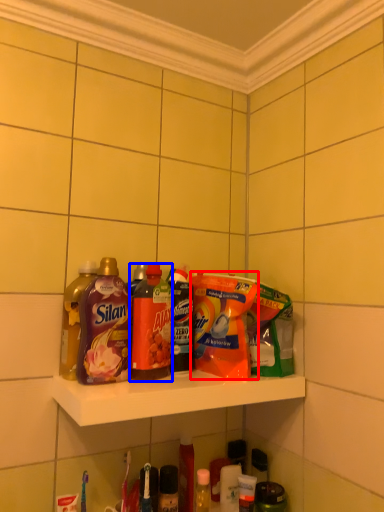
Question: Among these objects, which one is nearest to the camera, cleaning product (highlighted by a red box) or bottle (highlighted by a blue box)?

Choices:
 (A) cleaning product
 (B) bottle

Answer: (B)